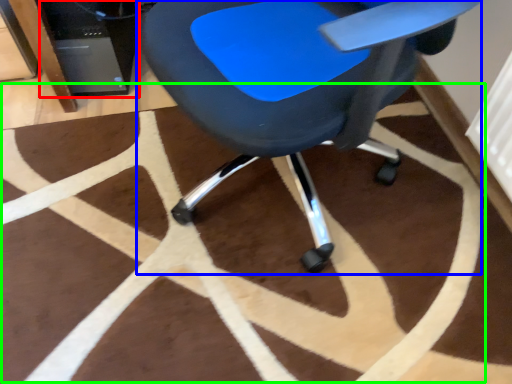
Question: Considering the real-world distances, which object is closest to computer tower (highlighted by a red box)? chair (highlighted by a blue box) or mat (highlighted by a green box).

Choices:
 (A) chair
 (B) mat

Answer: (B)